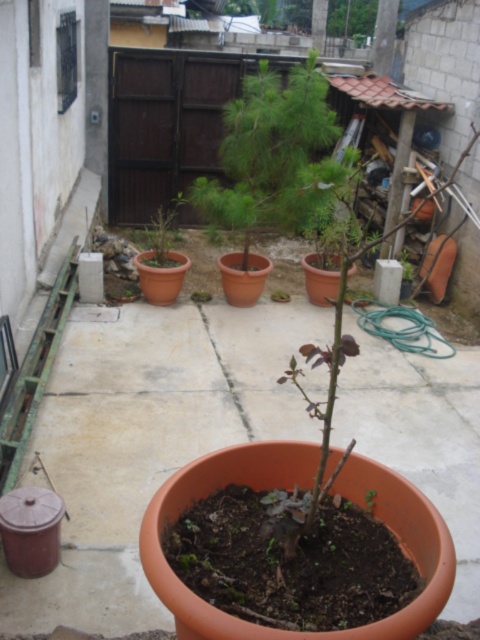
Is green matte tree at center in front of matte clay pot at center?

Yes.

Between point (307, 115) and point (166, 225), which one is positioned behind?

The point (166, 225) is more distant.

Locate an element on the screen. green matte tree at center is located at coordinates (272, 154).

Find the location of a particular element. The width and height of the screenshot is (480, 640). green matte tree at center is located at coordinates (272, 154).

Does matte brown pot at center appear over green matte plant at center?

Yes.

Does matte brown pot at center have a larger size compared to green matte plant at center?

Yes, matte brown pot at center is bigger than green matte plant at center.

Who is more forward, (x=399, y=259) or (x=369, y=508)?

Point (x=369, y=508) is in front.

Locate an element on the screen. This screenshot has height=640, width=480. matte brown pot at center is located at coordinates (406, 266).

Find the location of a particular element. The height and width of the screenshot is (640, 480). matte clay pot at center is located at coordinates (163, 234).

Which is above, matte clay pot at center or green matte plant at center?

matte clay pot at center

This screenshot has height=640, width=480. What are the coordinates of `matte clay pot at center` in the screenshot? It's located at (163, 234).

Locate an element on the screen. matte clay pot at center is located at coordinates (163, 234).